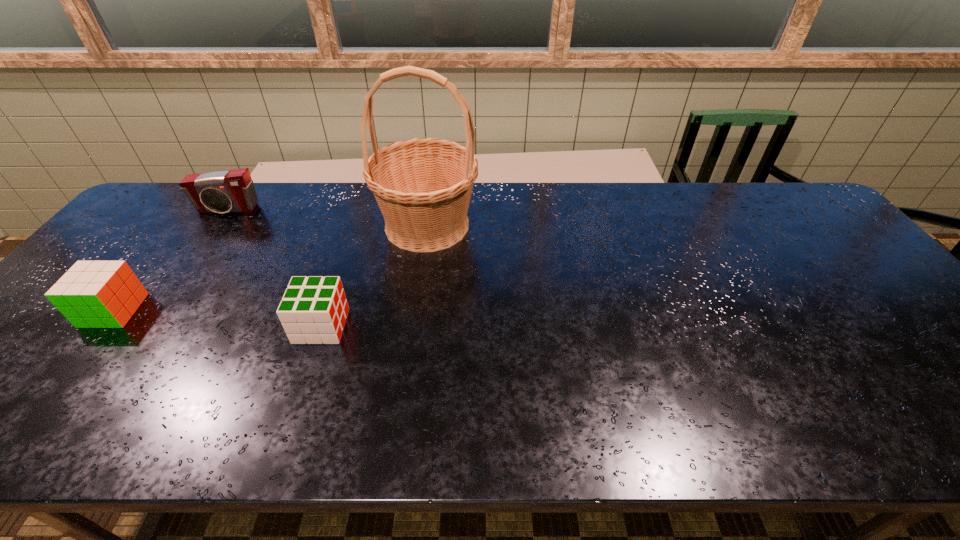
Locate an element on the screen. camera present at the far edge is located at coordinates (229, 191).

Where is `object situated at the left edge`? This screenshot has width=960, height=540. object situated at the left edge is located at coordinates (x=93, y=294).

Locate an element on the screen. The image size is (960, 540). vacant point at the far edge is located at coordinates (684, 187).

Where is `free space at the near edge of the desktop`? free space at the near edge of the desktop is located at coordinates (473, 434).

You are a GUI agent. You are given a task and a screenshot of the screen. Output one action in this format:
    pyautogui.click(x=<x>, y=<y>)
    Task: Click on the vacant area at the left edge of the desktop
    Image resolution: width=960 pixels, height=540 pixels.
    Given the screenshot: What is the action you would take?
    pyautogui.click(x=131, y=247)

Image resolution: width=960 pixels, height=540 pixels. Identify the location of vacant space at the right edge of the desktop. (875, 346).

This screenshot has height=540, width=960. In the image, there is a desktop. What are the coordinates of `vacant space at the far right corner` in the screenshot? It's located at (780, 206).

Find the location of `vacant area that lies between the right cube and the basket`. vacant area that lies between the right cube and the basket is located at coordinates (374, 275).

Where is `empty space between the camera and the basket`? The height and width of the screenshot is (540, 960). empty space between the camera and the basket is located at coordinates (327, 218).

At what (x,y) coordinates should I click in order to perform the action: click on free space that is in between the left cube and the third object from left to right. Please return your answer as a coordinate pair (x, y). The width and height of the screenshot is (960, 540). Looking at the image, I should click on (218, 318).